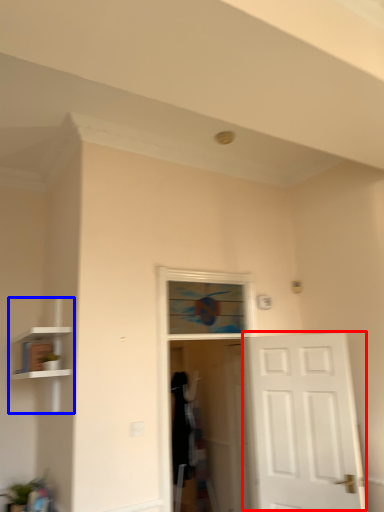
Question: Among these objects, which one is farthest to the camera, door (highlighted by a red box) or bookshelf (highlighted by a blue box)?

Choices:
 (A) door
 (B) bookshelf

Answer: (A)